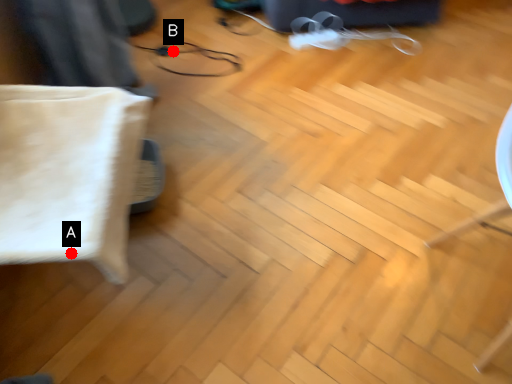
Question: Two points are circled on the image, labeled by A and B beside each circle. Which point is closer to the camera?

Choices:
 (A) A is closer
 (B) B is closer

Answer: (A)